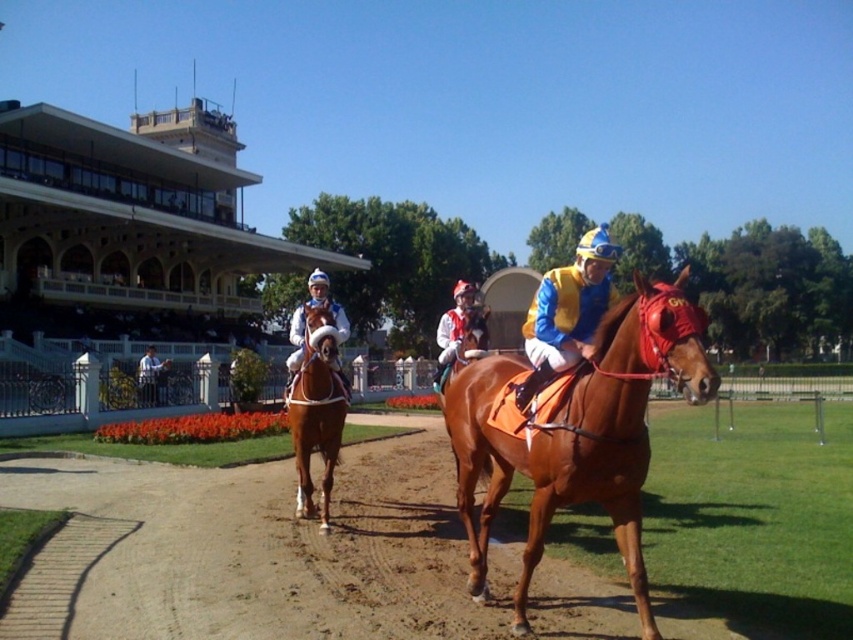
Question: Based on their relative distances, which object is farther from the white jersey at center?

Choices:
 (A) white fabric jacket at upper left
 (B) blue jersey at center

Answer: (A)

Question: Can you confirm if white jersey at center is positioned to the right of white matte helmet at center?

Choices:
 (A) yes
 (B) no

Answer: (A)

Question: Which is farther from the shiny brown horse at center?

Choices:
 (A) white jersey at center
 (B) white matte helmet at center
 (C) brown glossy horse at center
 (D) blue jersey at center

Answer: (A)

Question: Is brown glossy horse at center further to camera compared to white fabric jacket at upper left?

Choices:
 (A) no
 (B) yes

Answer: (A)

Question: Which is nearer to the white matte helmet at center?

Choices:
 (A) shiny brown horse at center
 (B) blue jersey at center
 (C) white jersey at center
 (D) brown glossy horse at center

Answer: (A)

Question: Can you confirm if white jersey at center is positioned to the left of white fabric jacket at upper left?

Choices:
 (A) yes
 (B) no

Answer: (B)